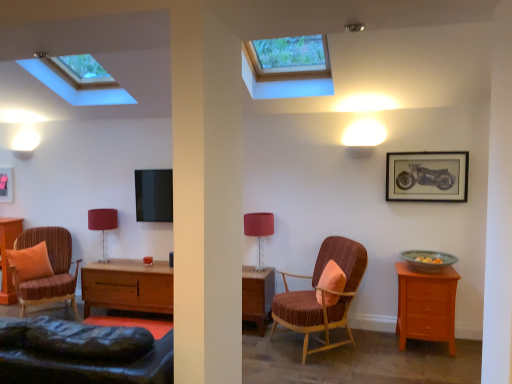
Question: Can light brown wooden chest of drawers at right be found inside matte black picture frame at upper right, marked as the second picture frame in a left-to-right arrangement?

Choices:
 (A) yes
 (B) no

Answer: (B)

Question: Is matte black picture frame at upper right, marked as the second picture frame in a left-to-right arrangement, shorter than light brown wooden chest of drawers at right?

Choices:
 (A) no
 (B) yes

Answer: (B)

Question: From a real-world perspective, is matte black picture frame at upper right, positioned as the first picture frame in front-to-back order, physically above light brown wooden chest of drawers at right?

Choices:
 (A) no
 (B) yes

Answer: (B)

Question: Can you confirm if matte black picture frame at upper right, marked as the second picture frame in a left-to-right arrangement, is thinner than light brown wooden chest of drawers at right?

Choices:
 (A) no
 (B) yes

Answer: (B)

Question: Could you tell me if matte black picture frame at upper right, positioned as the first picture frame in front-to-back order, is facing light brown wooden chest of drawers at right?

Choices:
 (A) yes
 (B) no

Answer: (B)

Question: Is matte black picture frame at upper right, positioned as the first picture frame in front-to-back order, positioned beyond the bounds of light brown wooden chest of drawers at right?

Choices:
 (A) no
 (B) yes

Answer: (B)

Question: Can you confirm if velvet-like brown armchair at center, the second chair in the left-to-right sequence, is positioned to the left of wooden nightstand at left?

Choices:
 (A) yes
 (B) no

Answer: (B)

Question: Is wooden nightstand at left at the back of velvet-like brown armchair at center, the second chair in the left-to-right sequence?

Choices:
 (A) no
 (B) yes

Answer: (A)

Question: Can you confirm if velvet-like brown armchair at center, which appears as the first chair when viewed from the right, is wider than wooden nightstand at left?

Choices:
 (A) yes
 (B) no

Answer: (A)

Question: Can you confirm if velvet-like brown armchair at center, which appears as the first chair when viewed from the right, is taller than wooden nightstand at left?

Choices:
 (A) yes
 (B) no

Answer: (A)

Question: Can you confirm if velvet-like brown armchair at center, the second chair in the left-to-right sequence, is shorter than wooden nightstand at left?

Choices:
 (A) yes
 (B) no

Answer: (B)

Question: Can you confirm if velvet-like brown armchair at center, the second chair in the left-to-right sequence, is smaller than wooden nightstand at left?

Choices:
 (A) yes
 (B) no

Answer: (B)

Question: Would you say matte black picture frame at upper right, marked as the second picture frame in a left-to-right arrangement, contains matte pink fabric at center, which appears as the 2th table lamp when viewed from the back?

Choices:
 (A) no
 (B) yes

Answer: (A)